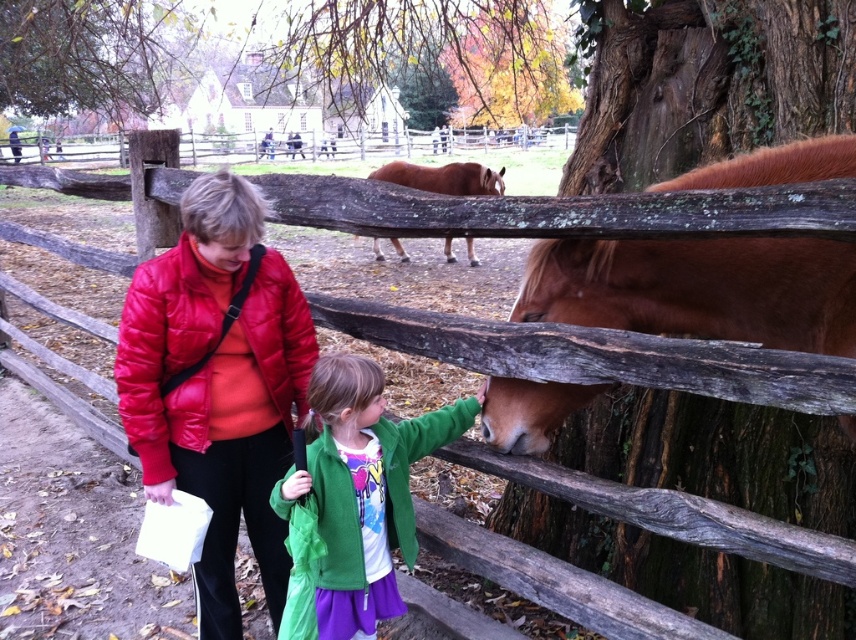
Who is more distant from viewer, (132, 314) or (568, 403)?

Positioned behind is point (568, 403).

Where is `shiny red jacket at left`? shiny red jacket at left is located at coordinates (217, 385).

Find the location of a particular element. The image size is (856, 640). shiny red jacket at left is located at coordinates (217, 385).

Can you confirm if shiny red jacket at left is bigger than brown glossy horse at center?

No.

Is point (189, 442) positioned in front of point (372, 246)?

Yes, it is in front of point (372, 246).

Image resolution: width=856 pixels, height=640 pixels. Find the location of `shiny red jacket at left`. shiny red jacket at left is located at coordinates (217, 385).

Between brown fuzzy horse at center and brown glossy horse at center, which one has less height?

brown glossy horse at center

Does brown fuzzy horse at center lie behind brown glossy horse at center?

That is False.

Where is `brown fuzzy horse at center`? brown fuzzy horse at center is located at coordinates (699, 289).